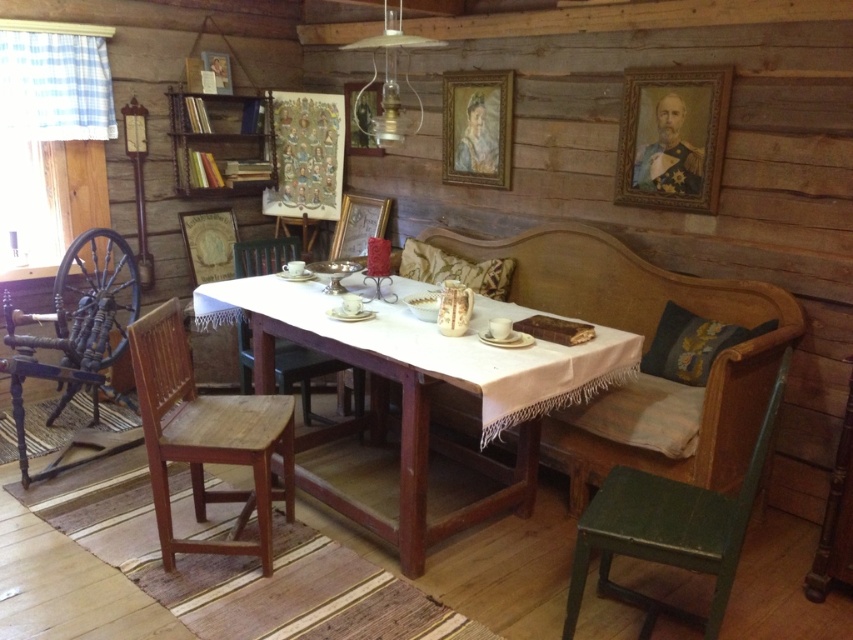
Is point (268, 371) positioned in front of point (703, 368)?

No.

Can you confirm if wooden table at center is shorter than embroidered fabric pillow at right?

Incorrect, wooden table at center's height does not fall short of embroidered fabric pillow at right's.

Between point (567, 392) and point (688, 362), which one is positioned behind?

Point (688, 362)

Find the location of a particular element. The width and height of the screenshot is (853, 640). wooden table at center is located at coordinates pyautogui.click(x=421, y=394).

Can you confirm if wooden chair at center is positioned to the left of velvet cushion at center?

Correct, you'll find wooden chair at center to the left of velvet cushion at center.

Is wooden chair at center bigger than velvet cushion at center?

Correct, wooden chair at center is larger in size than velvet cushion at center.

Between point (247, 348) and point (497, 257), which one is positioned in front?

Point (247, 348) is more forward.

Where is `wooden chair at center`? The image size is (853, 640). wooden chair at center is located at coordinates (302, 372).

Who is positioned more to the left, wooden table at center or wooden chair at lower left?

From the viewer's perspective, wooden chair at lower left appears more on the left side.

Who is more forward, (498, 406) or (160, 493)?

Point (498, 406) is more forward.

Who is more distant from viewer, (514, 388) or (184, 452)?

Positioned behind is point (184, 452).

In order to click on wooden table at center in this screenshot , I will do `click(421, 394)`.